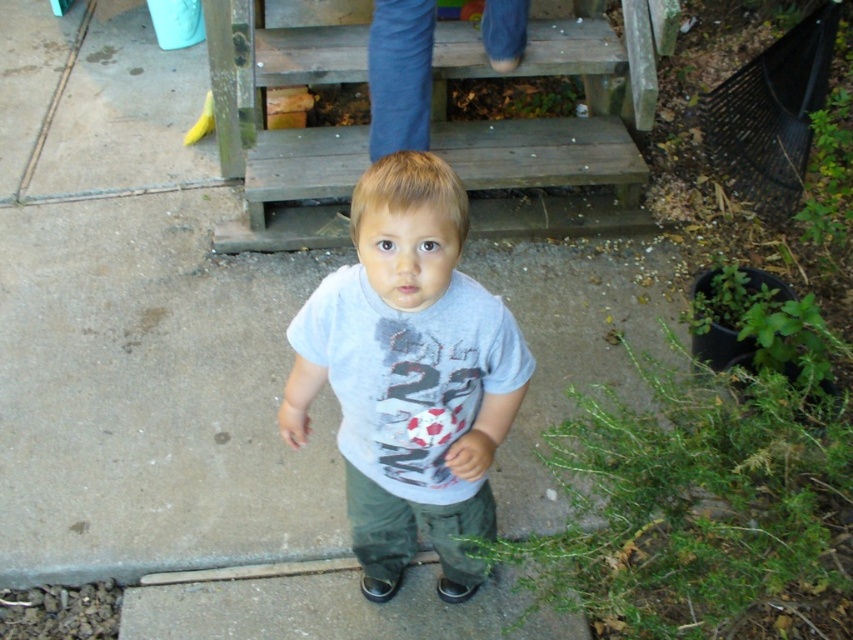
Who is positioned more to the left, gray cotton shirt at center or wooden stairs at upper center?

gray cotton shirt at center

Which is in front, point (498, 368) or point (651, 36)?

Positioned in front is point (498, 368).

Consider the image. Who is more forward, (397, 368) or (564, 120)?

Point (397, 368)

Find the location of a particular element. Image resolution: width=853 pixels, height=640 pixels. gray cotton shirt at center is located at coordinates (409, 376).